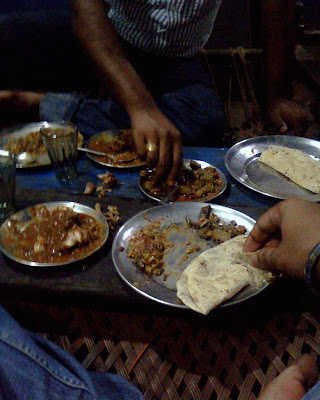
You are a GUI agent. You are given a task and a screenshot of the screen. Output one action in this format:
    pyautogui.click(x=<x>, y=<y>)
    Task: Click on the glass
    
    Given the screenshot: What is the action you would take?
    pyautogui.click(x=62, y=161)